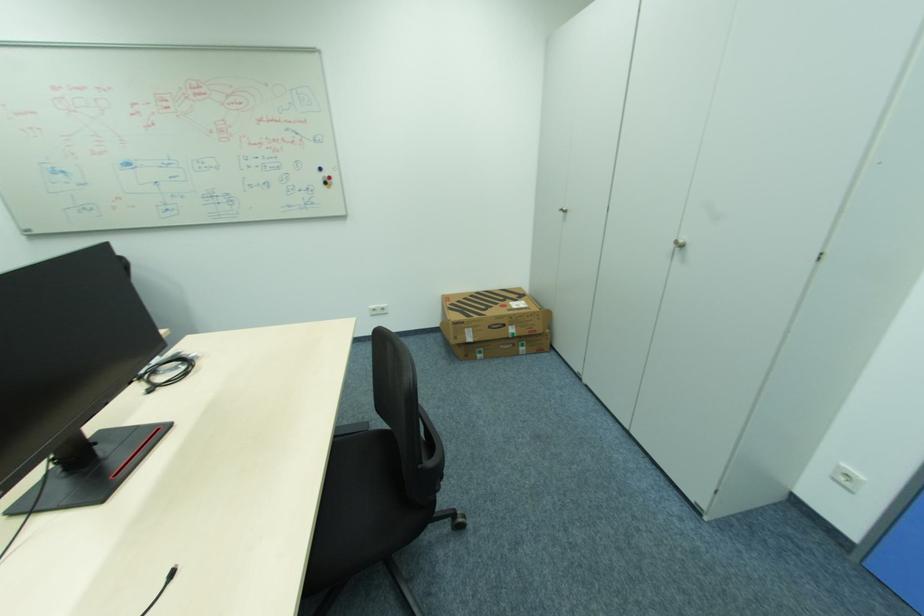
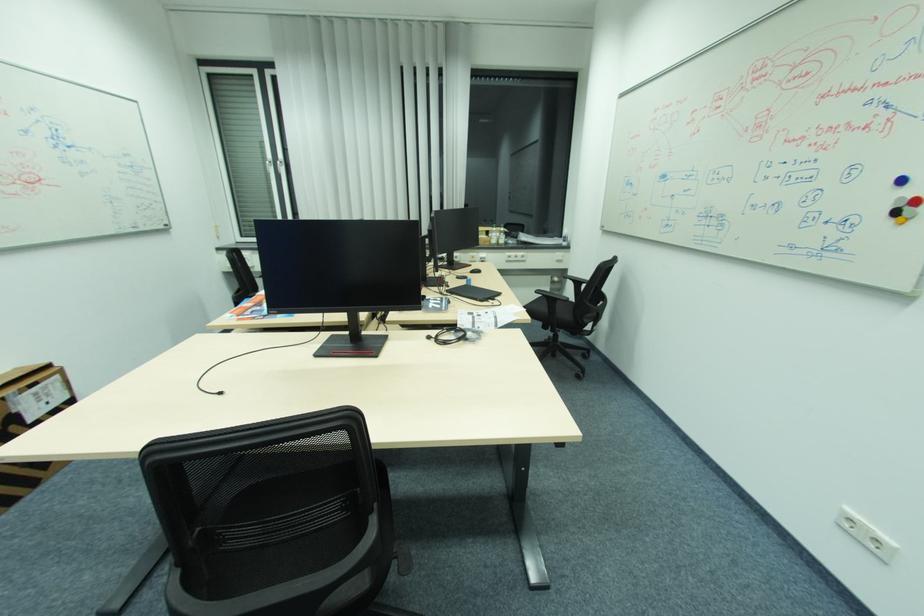
Locate, in the second image, the point that corresponds to [324,169] in the first image.

(908, 180)